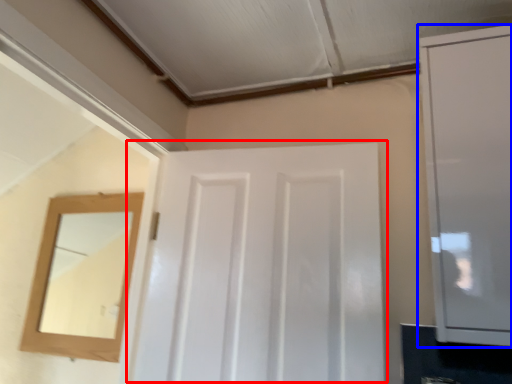
Question: Which object is closer to the camera taking this photo, door (highlighted by a red box) or cabinetry (highlighted by a blue box)?

Choices:
 (A) door
 (B) cabinetry

Answer: (B)